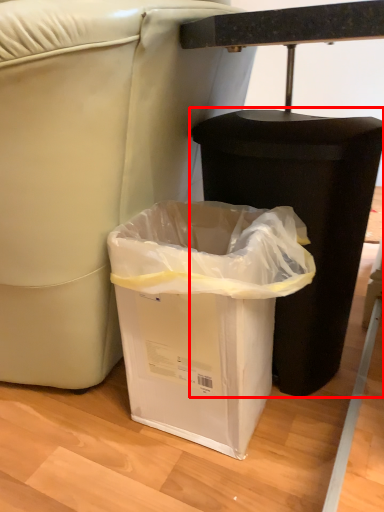
Question: From the image's perspective, considering the relative positions of waste container (annotated by the red box) and waste container in the image provided, where is waste container (annotated by the red box) located with respect to the staircase?

Choices:
 (A) below
 (B) above

Answer: (B)